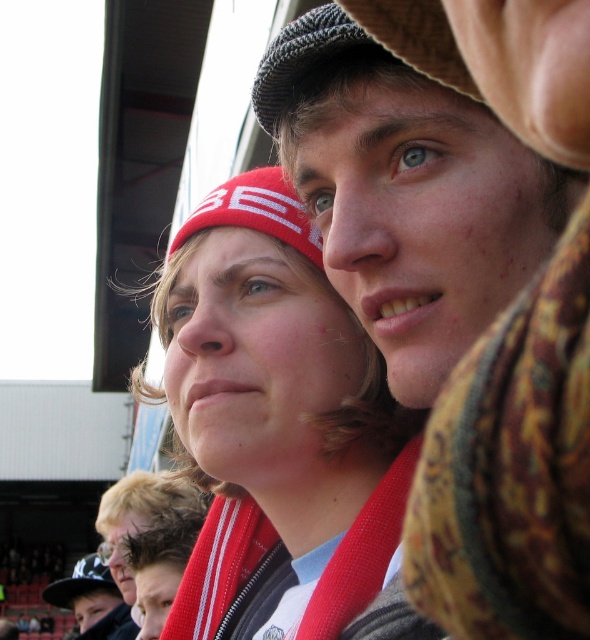
You are standing in the image and want to hand a gift to the person wearing the floral scarf at center. Which direction should you move to reach them?

The floral scarf at center is located at point 0.303 on the x and 0.688 on the y axis, so you should move towards the center of the image to reach them.